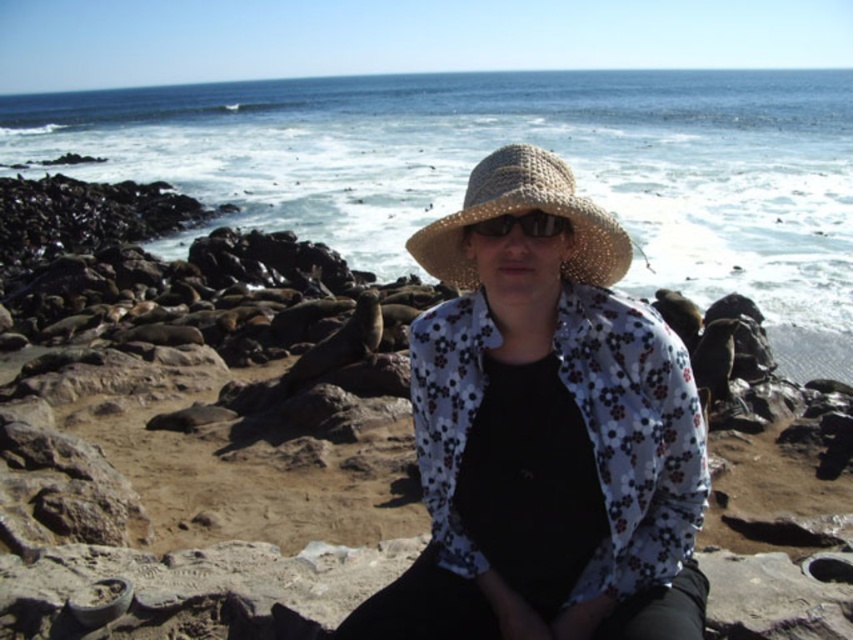
Question: Which point is farther to the camera?

Choices:
 (A) clear blue water at upper center
 (B) shiny metallic sunglasses at center
 (C) woven straw hat at center

Answer: (A)

Question: Which object is the farthest from the straw hat at center?

Choices:
 (A) woven straw hat at center
 (B) clear blue water at upper center
 (C) shiny metallic sunglasses at center

Answer: (B)

Question: Is straw hat at center positioned at the back of shiny metallic sunglasses at center?

Choices:
 (A) yes
 (B) no

Answer: (B)

Question: Is clear blue water at upper center to the right of straw hat at center from the viewer's perspective?

Choices:
 (A) no
 (B) yes

Answer: (B)

Question: Considering the relative positions of clear blue water at upper center and shiny metallic sunglasses at center in the image provided, where is clear blue water at upper center located with respect to shiny metallic sunglasses at center?

Choices:
 (A) left
 (B) right

Answer: (B)

Question: Which point is farther to the camera?

Choices:
 (A) woven straw hat at center
 (B) shiny metallic sunglasses at center
 (C) clear blue water at upper center
 (D) straw hat at center

Answer: (C)